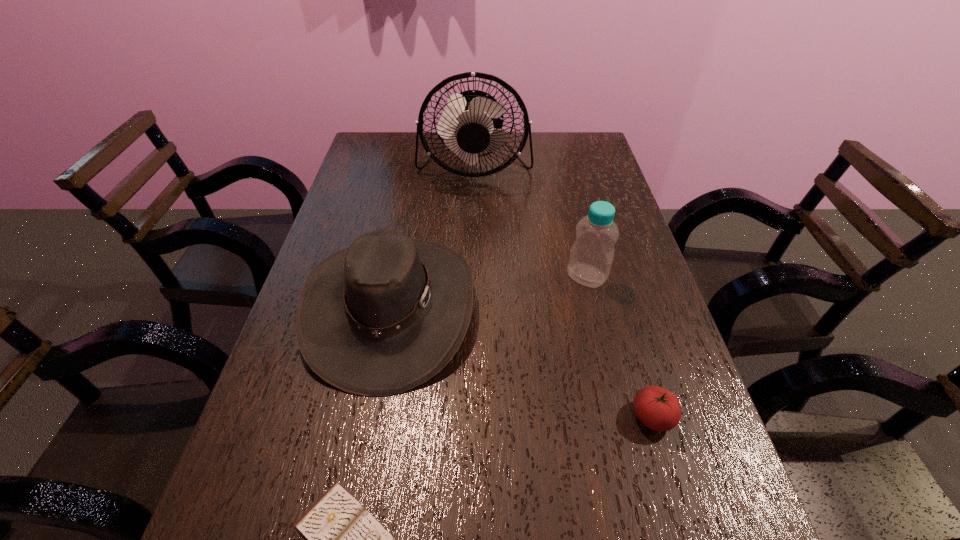
Where is `object present at the far edge`? object present at the far edge is located at coordinates (467, 124).

The image size is (960, 540). In order to click on object that is at the left edge in this screenshot , I will do `click(379, 318)`.

The width and height of the screenshot is (960, 540). I want to click on bottle present at the right edge, so click(x=591, y=256).

Where is `tomato at the right edge`? tomato at the right edge is located at coordinates (657, 408).

Identify the location of vacant space at the far edge of the desktop. (476, 168).

Locate an element on the screen. vacant space at the left edge of the desktop is located at coordinates (304, 514).

This screenshot has width=960, height=540. I want to click on free space at the right edge, so click(608, 181).

At what (x,y) coordinates should I click in order to perform the action: click on vacant space at the far left corner of the desktop. Please return your answer as a coordinate pair (x, y). This screenshot has width=960, height=540. Looking at the image, I should click on (407, 145).

In the image, there is a desktop. Where is `vacant space at the far right corner`? vacant space at the far right corner is located at coordinates (576, 132).

Find the location of a particular element. The height and width of the screenshot is (540, 960). free space between the tallest object and the second shortest object is located at coordinates (564, 292).